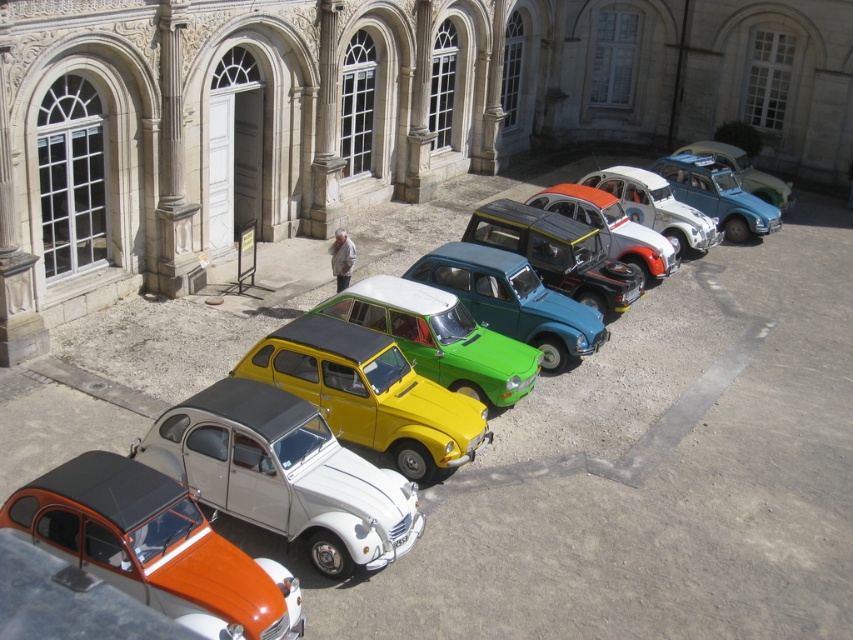
Image resolution: width=853 pixels, height=640 pixels. What do you see at coordinates (154, 547) in the screenshot? I see `orange matte car at lower left` at bounding box center [154, 547].

Image resolution: width=853 pixels, height=640 pixels. Find the location of `orange matte car at lower left`. orange matte car at lower left is located at coordinates [154, 547].

Is point (346, 554) positioned after point (560, 193)?

No.

Does white matte car at center come behind metallic silver car at center?

No, it is in front of metallic silver car at center.

Locate an element on the screen. white matte car at center is located at coordinates (283, 474).

Is matte black car at center taller than yellow matte toy car at center?

Indeed, matte black car at center has a greater height compared to yellow matte toy car at center.

Does matte black car at center have a greater width compared to yellow matte toy car at center?

Indeed, matte black car at center has a greater width compared to yellow matte toy car at center.

Where is `matte black car at center`? The image size is (853, 640). matte black car at center is located at coordinates (624, 390).